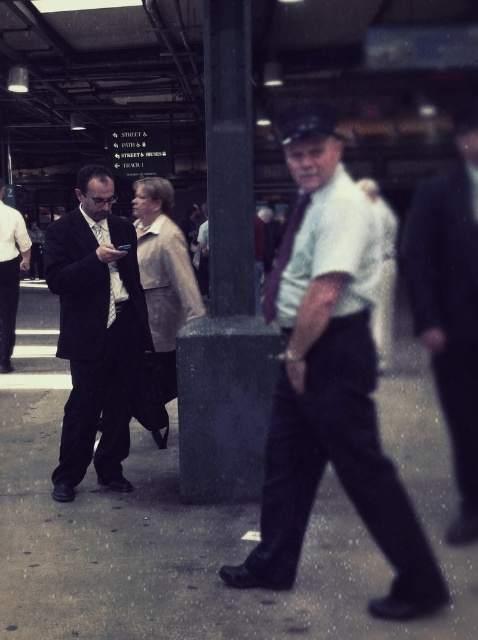
You are a photographer standing in the subway station and want to take a photo of the dark suit at left and the matte black tie at left. Which one should you adjust your camera focus on first to ensure both are in focus?

The dark suit at left is closer to the viewer than the matte black tie at left, so you should focus on the dark suit at left first to ensure both are in focus.